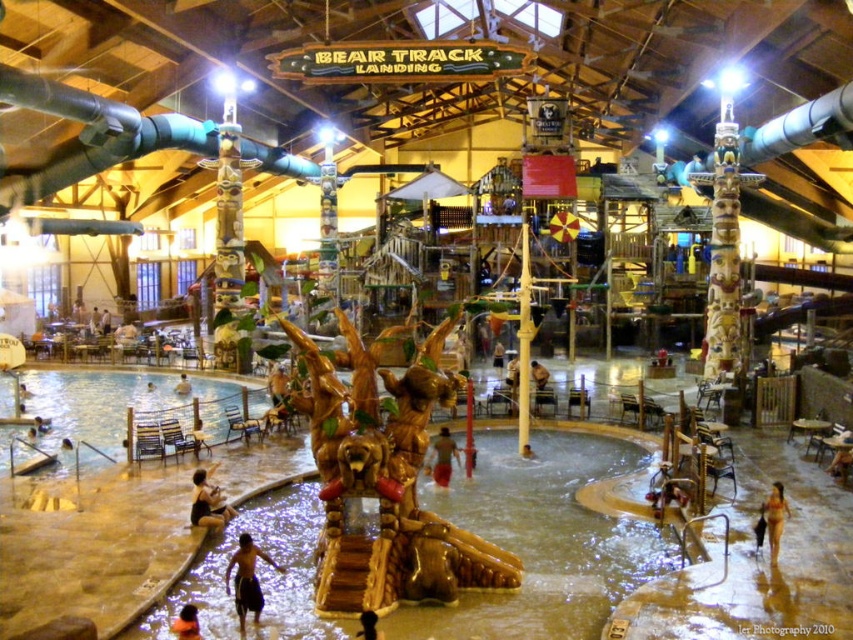
You are standing in the Bear Track Landing water park and see the dark brown shorts at lower center. If you want to move to the golden bear sculpture in the center, should you walk north or south?

The dark brown shorts at lower center are located at point (247,579). Since the golden bear sculpture is in the center, you should walk north to reach it from the lower center position.

You are a lifeguard at Bear Track Landing and need to ensure safety. You notice two visitors near the central bear sculpture. One is wearing dark brown shorts at lower center, and the other has smooth tan skin at center. Which visitor is closer to the edge of the shallow pool? Use the scene description to determine the answer.

The dark brown shorts at lower center is thinner than smooth tan skin at center, so the visitor with dark brown shorts at lower center is closer to the edge of the shallow pool since thinner objects are typically closer to the edges in such settings.

You are a visitor at Bear Track Landing and want to take a photo of the tan skin human at lower right and the orange fabric at lower left. Which object should you focus on first if you want to capture both in the same frame without moving your camera?

You should focus on the tan skin human at lower right first because it is wider than the orange fabric at lower left, so it will take up more space in the frame, ensuring both are captured without needing to adjust the camera position.